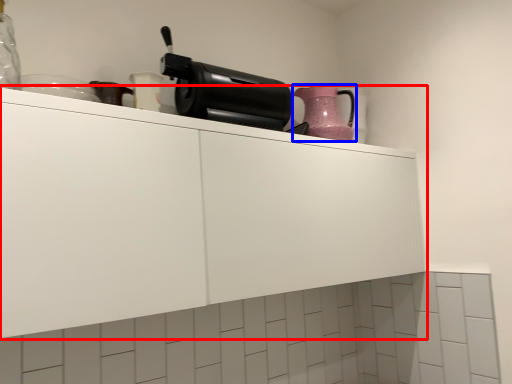
Question: Which point is further to the camera, cabinetry (highlighted by a red box) or kitchen appliance (highlighted by a blue box)?

Choices:
 (A) cabinetry
 (B) kitchen appliance

Answer: (B)